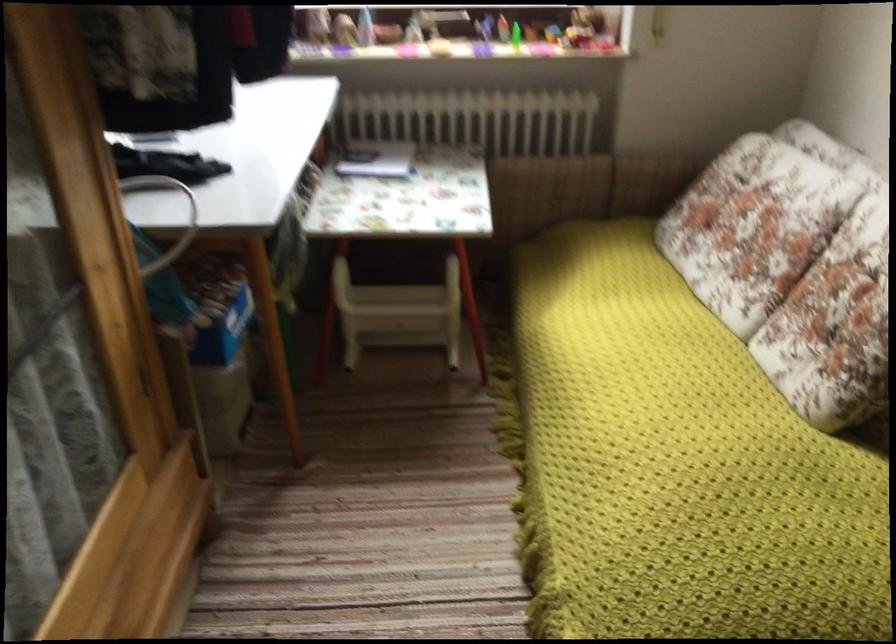
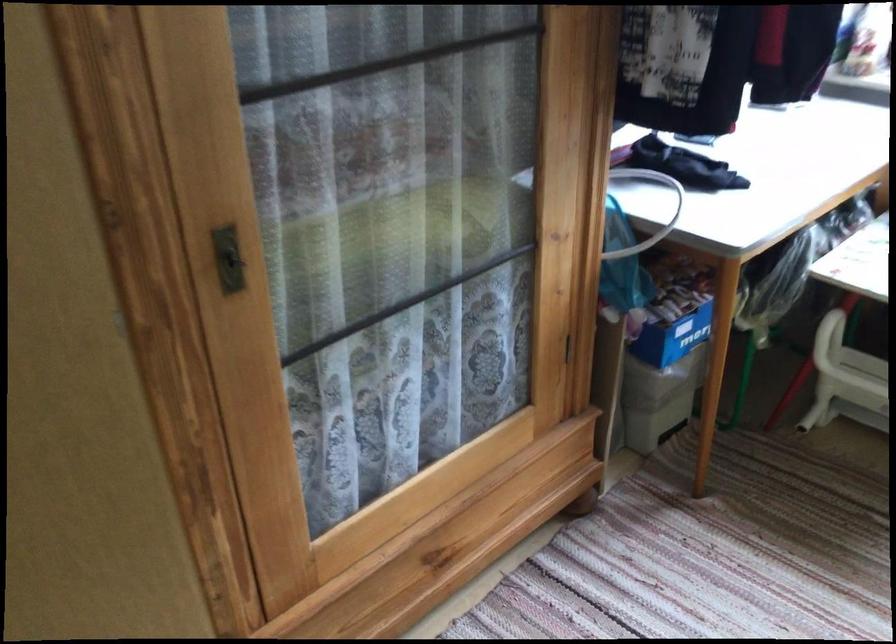
Question: The camera is either moving clockwise (left) or counter-clockwise (right) around the object. The first image is from the beginning of the video and the second image is from the end. Is the camera moving left or right when shooting the video?

Choices:
 (A) Left
 (B) Right

Answer: (B)